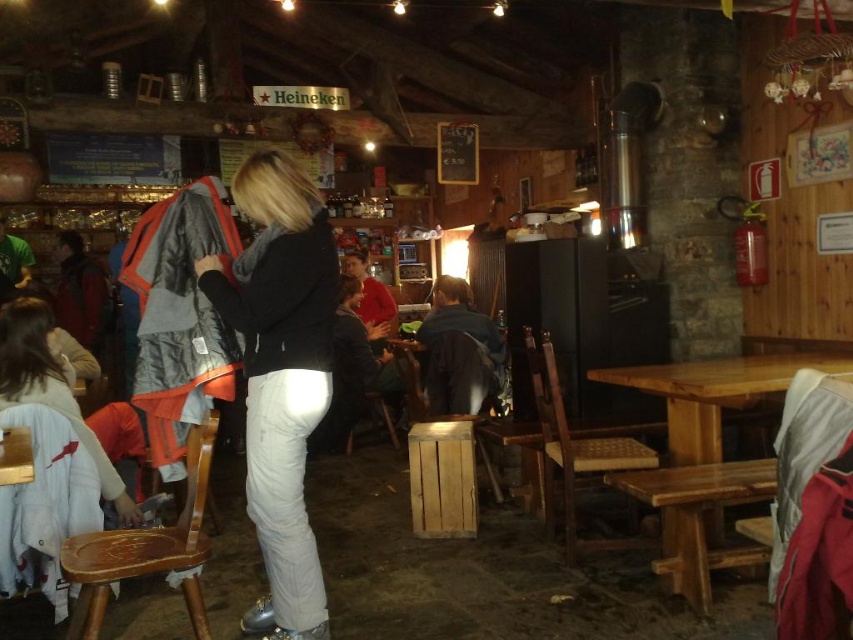
You are a customer in the rustic establishment and want to place your backpack on the wooden table at lower right. However, you notice the white matte pants at center. Will the backpack fit on the table without being blocked by the pants?

The white matte pants at center has a greater height compared to wooden table at lower right. Since the pants are taller than the table, placing the backpack on the table might be obstructed by the pants.

You are a customer sitting at the wooden table at lower right and you want to put your phone on the white matte pants at center. Is this feasible?

The white matte pants at center is above the wooden table at lower right, so you cannot place your phone on the white matte pants at center since it is not a flat surface.

You are a customer in this rustic establishment and want to place your 3.5 feet wide backpack on the floor between the white matte pants at center and the wooden table at lower right. Is there enough space for the backpack?

The distance between the white matte pants at center and the wooden table at lower right is 5.15 feet, which is greater than the backpack width of 3.5 feet. Therefore, there is enough space to place the backpack between them.